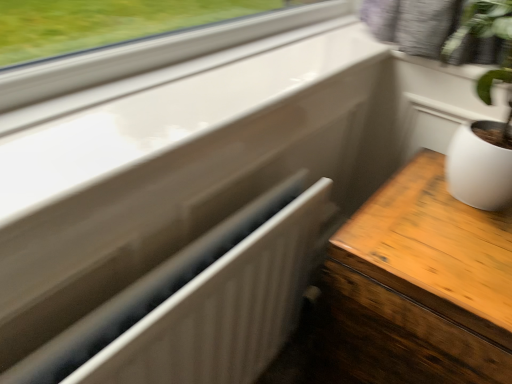
Question: Can you confirm if wooden table at right is shorter than white matte radiator at center?

Choices:
 (A) no
 (B) yes

Answer: (A)

Question: Could you tell me if wooden table at right is facing white matte radiator at center?

Choices:
 (A) yes
 (B) no

Answer: (B)

Question: Is the depth of wooden table at right less than that of white matte radiator at center?

Choices:
 (A) yes
 (B) no

Answer: (B)

Question: Is wooden table at right at the left side of white matte radiator at center?

Choices:
 (A) no
 (B) yes

Answer: (A)

Question: Can white matte radiator at center be found inside wooden table at right?

Choices:
 (A) yes
 (B) no

Answer: (B)

Question: Is wooden table at right positioned behind white matte radiator at center?

Choices:
 (A) yes
 (B) no

Answer: (A)

Question: Would you say white matte radiator at center contains wooden table at right?

Choices:
 (A) no
 (B) yes

Answer: (A)

Question: From the image's perspective, is white matte radiator at center on wooden table at right?

Choices:
 (A) no
 (B) yes

Answer: (B)

Question: Is white matte radiator at center to the right of wooden table at right from the viewer's perspective?

Choices:
 (A) yes
 (B) no

Answer: (B)

Question: From a real-world perspective, is white matte radiator at center under wooden table at right?

Choices:
 (A) no
 (B) yes

Answer: (A)

Question: Is white matte radiator at center with wooden table at right?

Choices:
 (A) no
 (B) yes

Answer: (A)

Question: Considering the relative positions of white matte radiator at center and wooden table at right in the image provided, is white matte radiator at center in front of wooden table at right?

Choices:
 (A) yes
 (B) no

Answer: (A)

Question: Relative to white matte radiator at center, is wooden table at right in front or behind?

Choices:
 (A) front
 (B) behind

Answer: (B)